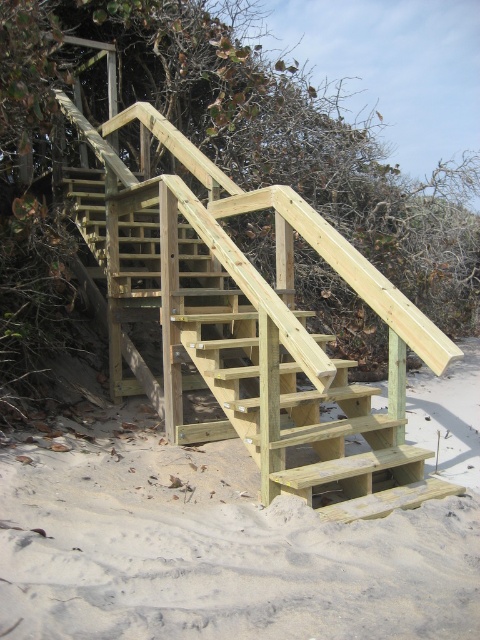
What do you see at coordinates (235, 538) in the screenshot?
I see `light brown wood stairs at center` at bounding box center [235, 538].

Is light brown wood stairs at center closer to camera compared to natural wood stairs at center?

That is True.

Describe the element at coordinates (235, 538) in the screenshot. I see `light brown wood stairs at center` at that location.

Identify the location of light brown wood stairs at center. The width and height of the screenshot is (480, 640). (235, 538).